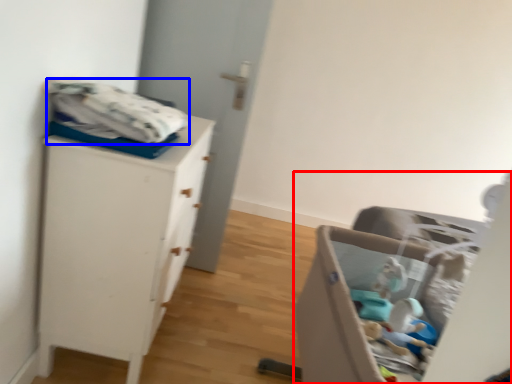
Question: Which object appears farthest to the camera in this image, furniture (highlighted by a red box) or baby clothe (highlighted by a blue box)?

Choices:
 (A) furniture
 (B) baby clothe

Answer: (B)